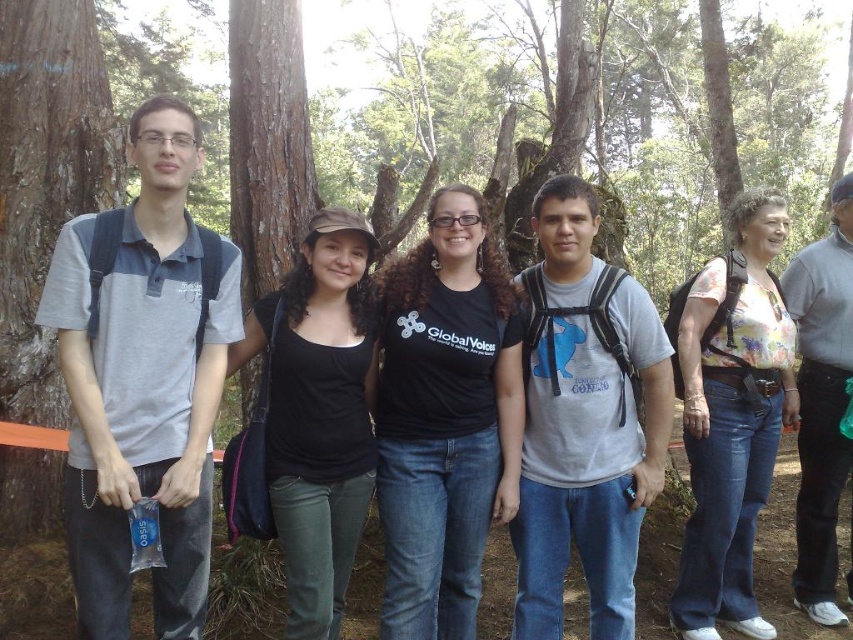
Question: Considering the real-world distances, which object is farthest from the floral fabric shirt at right?

Choices:
 (A) gray matte t-shirt at center
 (B) floral print blouse at right
 (C) black matte tank top at center
 (D) brown rough bark at left

Answer: (D)

Question: Can you confirm if gray cotton polo shirt at left is bigger than floral fabric shirt at right?

Choices:
 (A) yes
 (B) no

Answer: (B)

Question: Among these points, which one is nearest to the camera?

Choices:
 (A) (26, 460)
 (B) (412, 588)

Answer: (B)

Question: Does gray matte t-shirt at center have a larger size compared to black matte tank top at center?

Choices:
 (A) no
 (B) yes

Answer: (B)

Question: Estimate the real-world distances between objects in this image. Which object is farther from the black matte t-shirt at center?

Choices:
 (A) black matte tank top at center
 (B) floral fabric shirt at right

Answer: (B)

Question: Is gray cotton polo shirt at left above gray matte t-shirt at center?

Choices:
 (A) yes
 (B) no

Answer: (A)